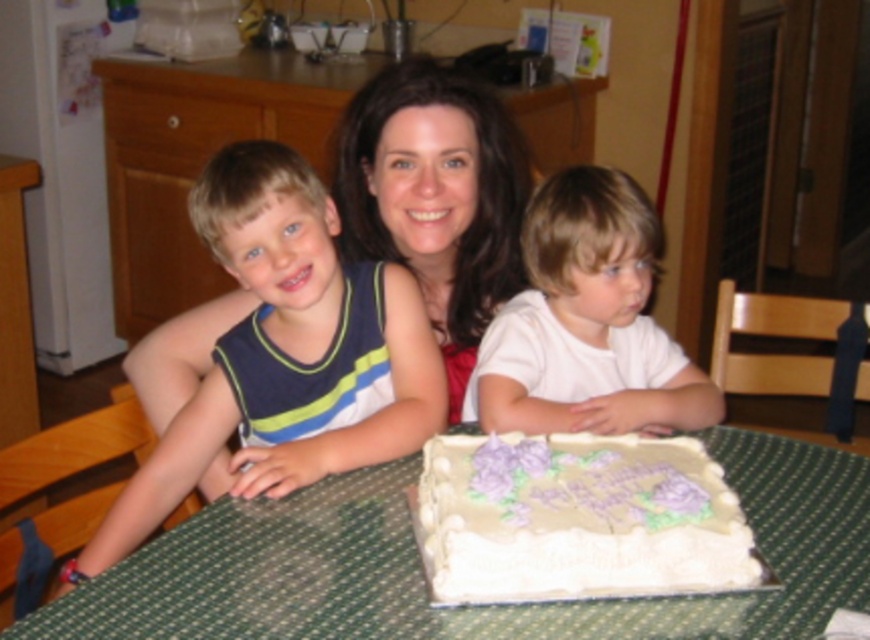
Is green fabric table at center below white frosted cake at center?

Correct, green fabric table at center is located below white frosted cake at center.

Which of these two, green fabric table at center or white frosted cake at center, stands taller?

With more height is green fabric table at center.

Which is behind, point (358, 477) or point (740, 556)?

The point (358, 477) is behind.

The height and width of the screenshot is (640, 870). In order to click on green fabric table at center in this screenshot , I will do `click(474, 605)`.

Which is behind, point (641, 568) or point (536, 355)?

Positioned behind is point (536, 355).

Between point (507, 550) and point (621, 385), which one is positioned in front?

Positioned in front is point (507, 550).

Find the location of `white frosted cake at center`. white frosted cake at center is located at coordinates (576, 518).

Is blue striped tank top at left bigger than white frosted cake at center?

Yes.

Locate an element on the screen. The width and height of the screenshot is (870, 640). blue striped tank top at left is located at coordinates (285, 353).